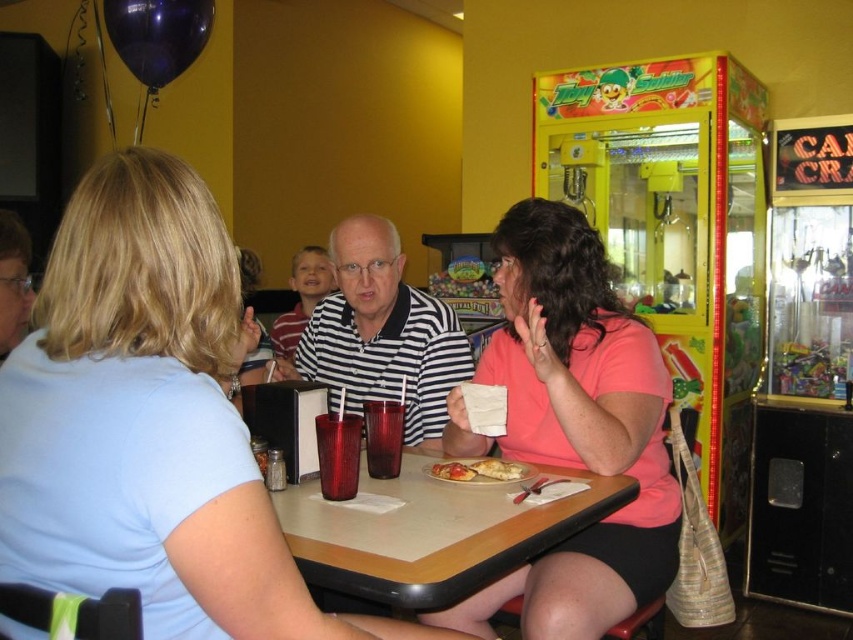
You are a waiter at the restaurant and need to place a small dessert plate between the two points indicated by the coordinates point (x=349, y=440) and point (x=488, y=470). Which point should you place the plate closer to in order to ensure it is nearer to the viewer?

You should place the dessert plate closer to point (x=349, y=440) because it is closer to the viewer than point (x=488, y=470).

You are a server at the restaurant and need to place a new drink order on the table. The drink is in a cup that is 10 cm tall. Considering the existing items on the table, will the translucent red glass at table center have enough vertical space to accommodate the new drink without it touching the golden crispy pizza slice at center?

The translucent red glass at table center is taller than the golden crispy pizza slice at center. Since the drink cup is 10 cm tall, placing it in the translucent red glass at table center would leave enough vertical space as the glass itself is taller, so the drink won???t touch the pizza slice.

You are a waiter holding a golden crispy pizza slice at center and need to serve it to the person wearing the light blue shirt at center. Can you place the pizza slice directly in front of them without it overlapping the shirt?

The light blue shirt at center might be wider than the golden crispy pizza slice at center, so there is a possibility that placing the pizza slice directly in front of them could overlap the shirt. Check the exact dimensions before placing it.